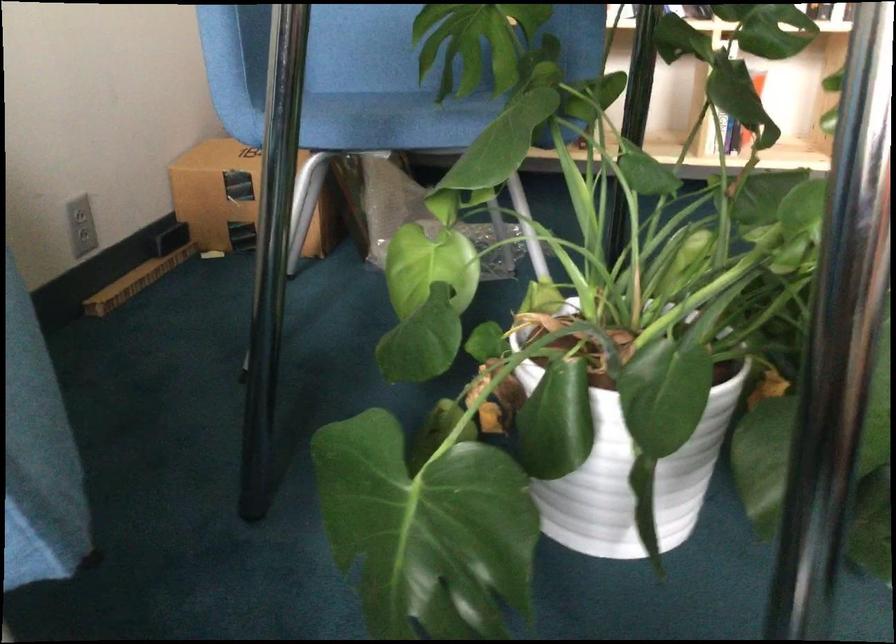
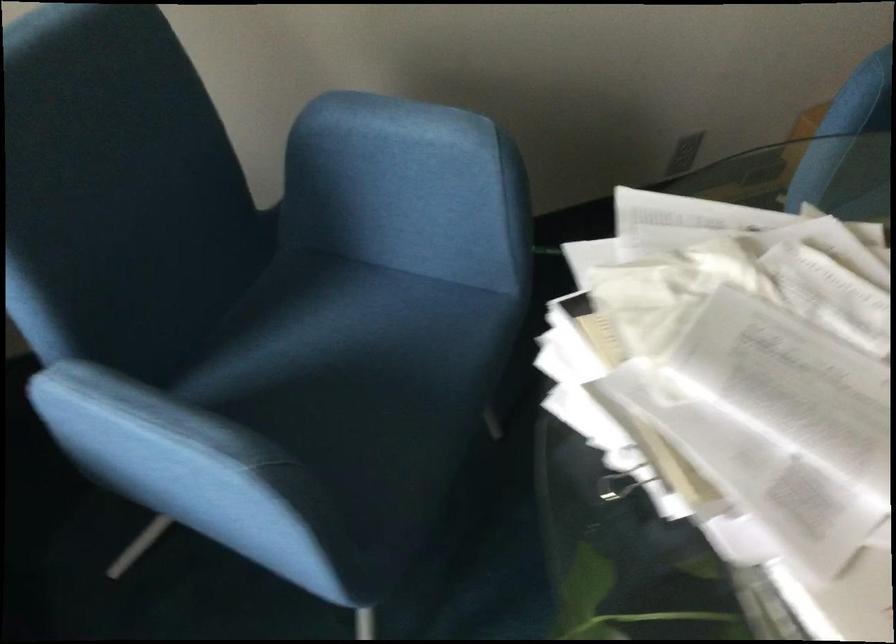
In the scene shown: Based on the continuous images, in which direction is the camera rotating?

The rotation direction of the camera is left-down.